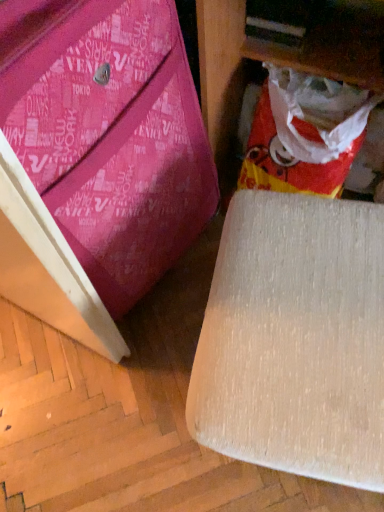
You are a GUI agent. You are given a task and a screenshot of the screen. Output one action in this format:
    pyautogui.click(x=<x>, y=<y>)
    Task: Click on the free space above beige fabric chair at lower right, the first furniture from the right (from a real-world perspective)
    Image resolution: width=384 pixels, height=512 pixels.
    Given the screenshot: What is the action you would take?
    pyautogui.click(x=304, y=313)